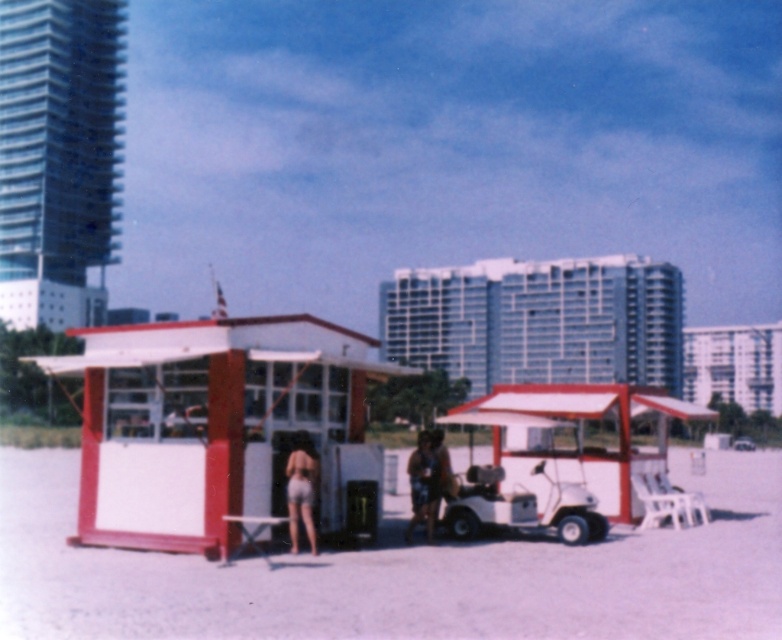
Question: Is white plastic chair at center closer to the viewer compared to matte brown shorts at center?

Choices:
 (A) no
 (B) yes

Answer: (B)

Question: Among these points, which one is nearest to the camera?

Choices:
 (A) coord(510,413)
 (B) coord(436,440)

Answer: (B)

Question: Which of the following is the closest to the observer?

Choices:
 (A) white plastic chair at center
 (B) light blue denim shorts at center

Answer: (A)

Question: Which point is closer to the camera?

Choices:
 (A) (641, 452)
 (B) (239, 492)

Answer: (B)

Question: Can you confirm if white painted wood hut at center is positioned to the left of light blue denim shorts at center?

Choices:
 (A) yes
 (B) no

Answer: (A)

Question: Is the position of white plastic chair at center more distant than that of matte brown shorts at center?

Choices:
 (A) yes
 (B) no

Answer: (B)